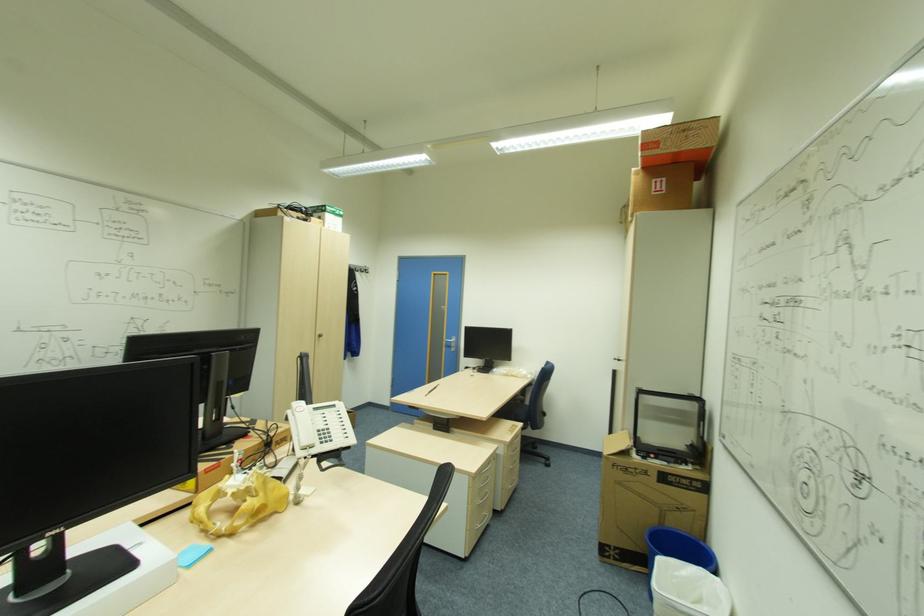
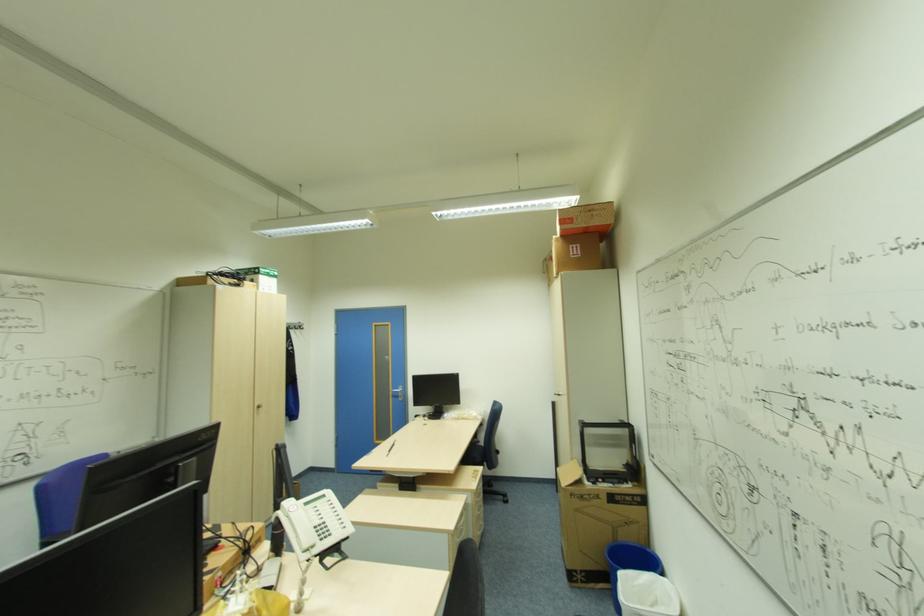
Question: The camera is either moving clockwise (left) or counter-clockwise (right) around the object. The first image is from the beginning of the video and the second image is from the end. Is the camera moving left or right when shooting the video?

Choices:
 (A) Left
 (B) Right

Answer: (A)